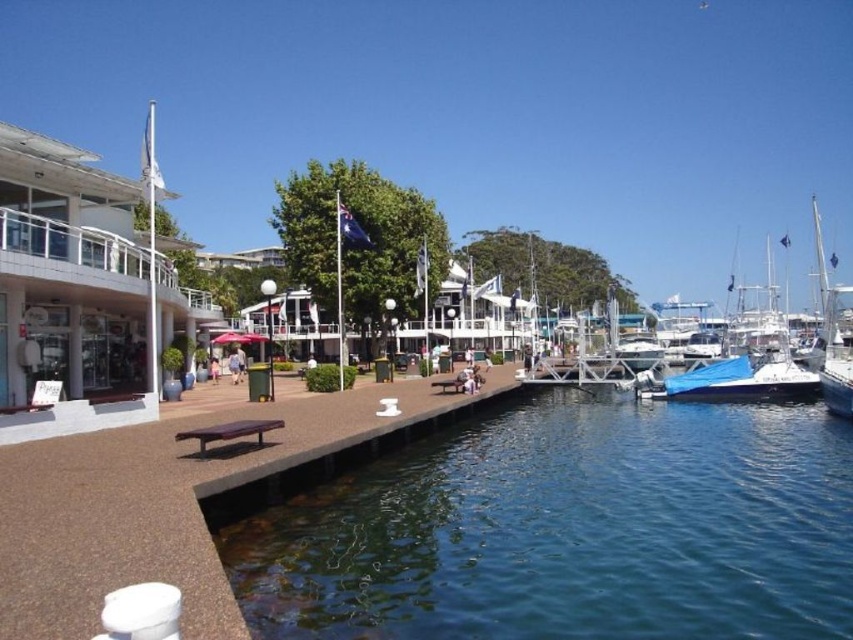
You are planning to set up a small outdoor event near the waterfront. You have a banner that is 2 meters wide that you want to hang between the clear blue water at lower center and the brown wooden picnic table at center. Is there enough space to hang the banner horizontally between them?

The clear blue water at lower center and the brown wooden picnic table at center are 18.42 meters apart, so yes, there is enough space to hang the banner horizontally between them since the distance is greater than the banner width of 2 meters.

You are planning to set up a small event on the brown wooden picnic table at center. You have a large tent that requires a minimum of 10 square meters of space. Can the blue tarpaulin boat at right provide enough space for the tent if it is moved next to the picnic table?

The blue tarpaulin boat at right is larger in size than the brown wooden picnic table at center. However, the exact dimensions of both objects are not provided. Without knowing the specific size of the boat, it is impossible to determine if it can accommodate the tent requiring 10 square meters.

You are standing at the edge of the waterfront scene and want to locate the clear blue water at lower center. According to the coordinates provided, where exactly is it positioned?

The clear blue water at lower center is positioned at coordinates point 0.830 on the x axis and 0.667 on the y axis.